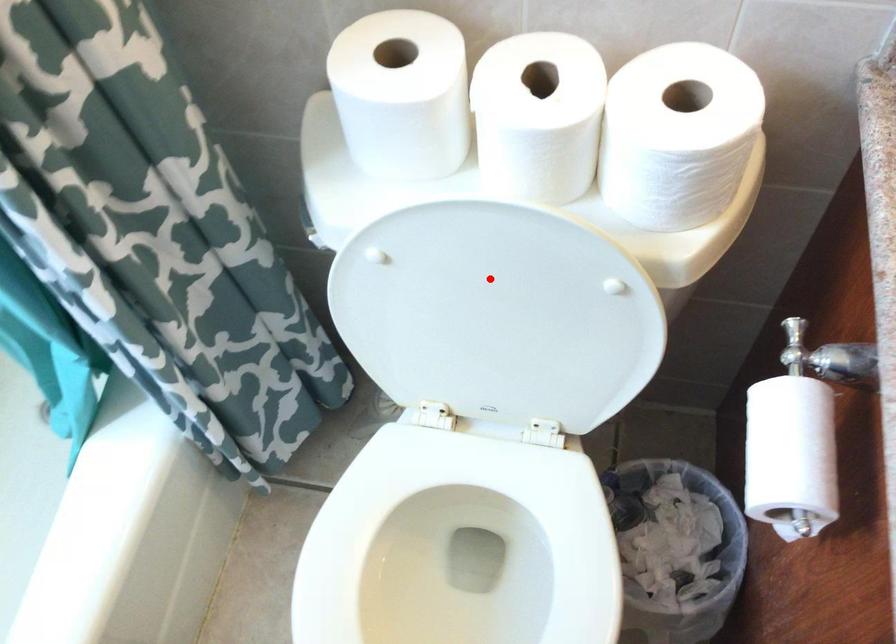
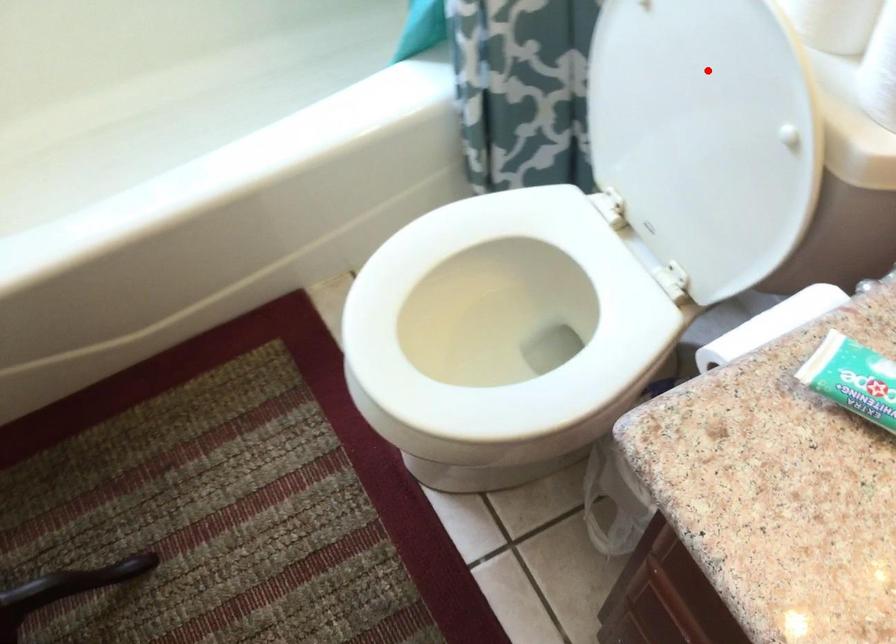
I am providing you with two images of the same scene from different viewpoints. A red point is marked on the first image and another point is marked on the second image. Do the highlighted points in image1 and image2 indicate the same real-world spot?

Yes